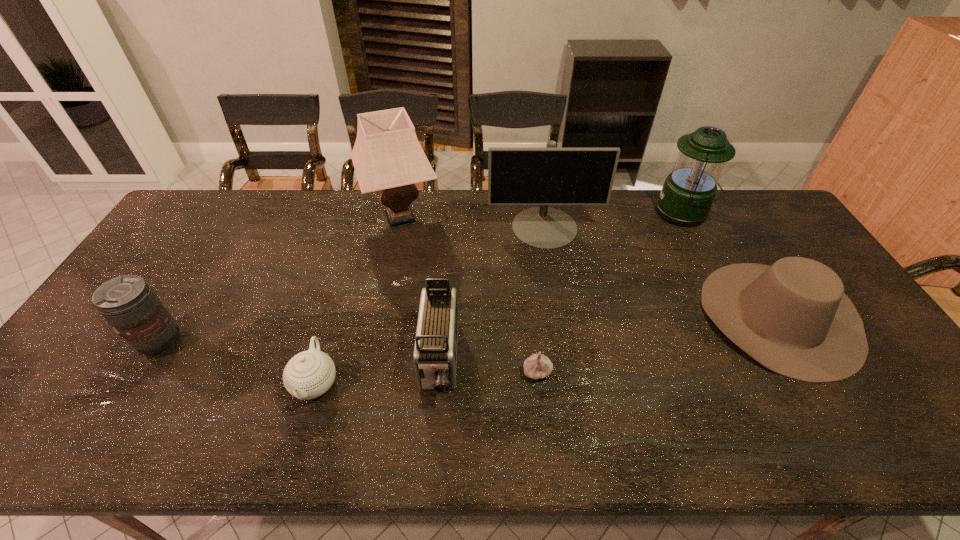
At what (x,y) coordinates should I click in order to perform the action: click on free space between the cowboy hat and the camcorder. Please return your answer as a coordinate pair (x, y). Looking at the image, I should click on (610, 339).

Find the location of a particular element. The height and width of the screenshot is (540, 960). vacant region between the lantern and the cowboy hat is located at coordinates (732, 265).

Identify the location of vacant area that lies between the garlic and the cowboy hat. pos(659,344).

Where is `object that ranks as the second closest to the lampshade`? object that ranks as the second closest to the lampshade is located at coordinates (435, 351).

The image size is (960, 540). What are the coordinates of `object that is the fourth closest one to the seventh tallest object` in the screenshot? It's located at (537, 366).

In order to click on free point that satisfies the following two spatial constraints: 1. on the front side of the lampshade; 2. on the side of the telephoto lens where the control switches are located in this screenshot , I will do [x=375, y=343].

Where is `vacant space that satisfies the following two spatial constraints: 1. on the back side of the lantern; 2. on the left side of the garlic`? This screenshot has height=540, width=960. vacant space that satisfies the following two spatial constraints: 1. on the back side of the lantern; 2. on the left side of the garlic is located at coordinates (521, 213).